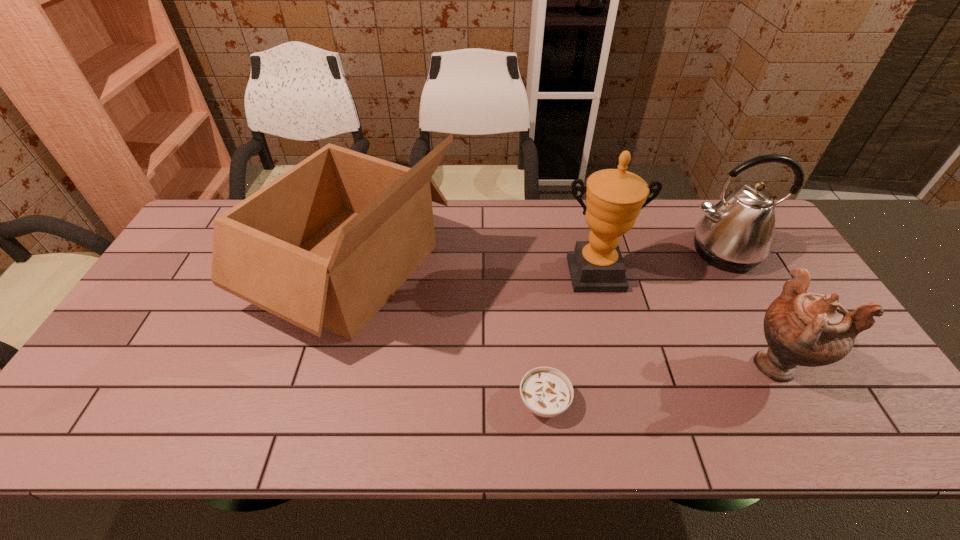
At what (x,y) coordinates should I click in order to perform the action: click on vacant space at the near left corner of the desktop. Please return your answer as a coordinate pair (x, y). The width and height of the screenshot is (960, 540). Looking at the image, I should click on (68, 410).

Locate an element on the screen. blank region between the fourth tallest object and the box is located at coordinates pos(564,316).

Find the location of a particular element. The height and width of the screenshot is (540, 960). empty space between the second object from left to right and the third shortest object is located at coordinates click(634, 327).

Where is `free space between the third object from left to right and the fourth object from right to left`? Image resolution: width=960 pixels, height=540 pixels. free space between the third object from left to right and the fourth object from right to left is located at coordinates point(569,338).

The width and height of the screenshot is (960, 540). I want to click on unoccupied position between the leftmost object and the third object from right to left, so click(472, 271).

This screenshot has height=540, width=960. Identify the location of empty location between the third object from right to left and the shortest object. (569, 338).

Image resolution: width=960 pixels, height=540 pixels. Find the location of `free space that is in between the third tallest object and the second shortest object`. free space that is in between the third tallest object and the second shortest object is located at coordinates (750, 308).

Locate an element on the screen. This screenshot has height=540, width=960. empty space between the second object from left to right and the box is located at coordinates pos(447,335).

The image size is (960, 540). Find the location of `free space between the second object from left to right and the leftmost object`. free space between the second object from left to right and the leftmost object is located at coordinates (447, 335).

This screenshot has height=540, width=960. In order to click on vacant space that is in between the award and the kettle in this screenshot , I will do `click(659, 263)`.